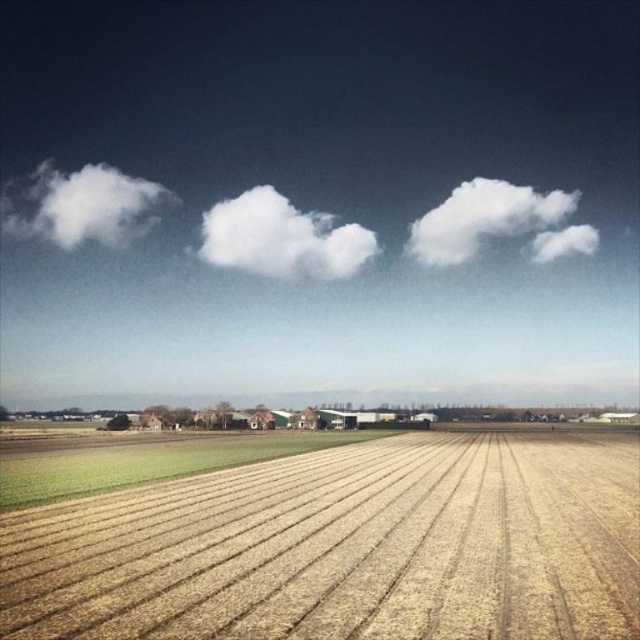
Question: Is green grassy field at lower left smaller than white fluffy cloud at center?

Choices:
 (A) yes
 (B) no

Answer: (B)

Question: Which object is positioned farthest from the green grassy field at lower left?

Choices:
 (A) white fluffy cloud at upper left
 (B) white fluffy cloud at upper center
 (C) white fluffy cloud at center

Answer: (A)

Question: Is green grassy field at lower left wider than white fluffy cloud at upper left?

Choices:
 (A) no
 (B) yes

Answer: (A)

Question: Which of the following is the farthest from the observer?

Choices:
 (A) green grassy field at lower left
 (B) white fluffy cloud at center
 (C) golden textured wheat field at center

Answer: (B)

Question: Is green grassy field at lower left thinner than white fluffy cloud at upper left?

Choices:
 (A) yes
 (B) no

Answer: (A)

Question: Which point is closer to the camera?

Choices:
 (A) white fluffy cloud at center
 (B) white fluffy cloud at upper center

Answer: (A)